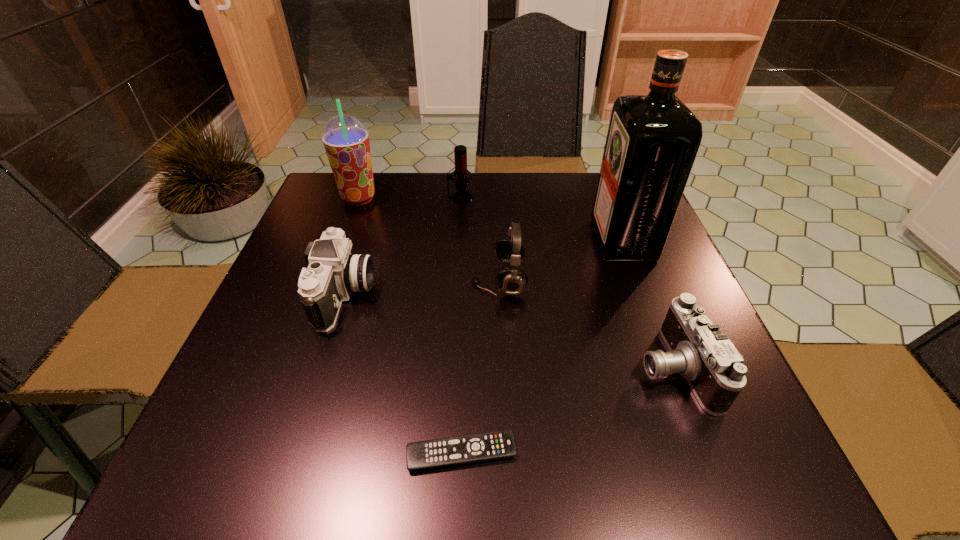
In order to click on object present at the far left corner in this screenshot , I will do pyautogui.click(x=346, y=140).

The height and width of the screenshot is (540, 960). What are the coordinates of `object that is positioned at the far right corner` in the screenshot? It's located at (652, 141).

In the image, there is a desktop. Where is `free space at the far edge`? free space at the far edge is located at coordinates (436, 173).

At what (x,y) coordinates should I click in order to perform the action: click on vacant space at the near edge of the desktop. Please return your answer as a coordinate pair (x, y). The height and width of the screenshot is (540, 960). Looking at the image, I should click on (372, 432).

The image size is (960, 540). In the image, there is a desktop. Identify the location of vacant space at the left edge. (309, 365).

Find the location of a particular element. This screenshot has height=540, width=960. vacant space at the right edge of the desktop is located at coordinates (640, 369).

I want to click on free space at the far left corner of the desktop, so pyautogui.click(x=359, y=221).

Identify the location of free space between the second shortest object and the tallest object. Image resolution: width=960 pixels, height=540 pixels. (648, 303).

Identify the location of vacant area that lies between the microphone and the smoothie. The image size is (960, 540). (409, 198).

Locate an element on the screen. Image resolution: width=960 pixels, height=540 pixels. empty location between the right camera and the nearest object is located at coordinates (567, 410).